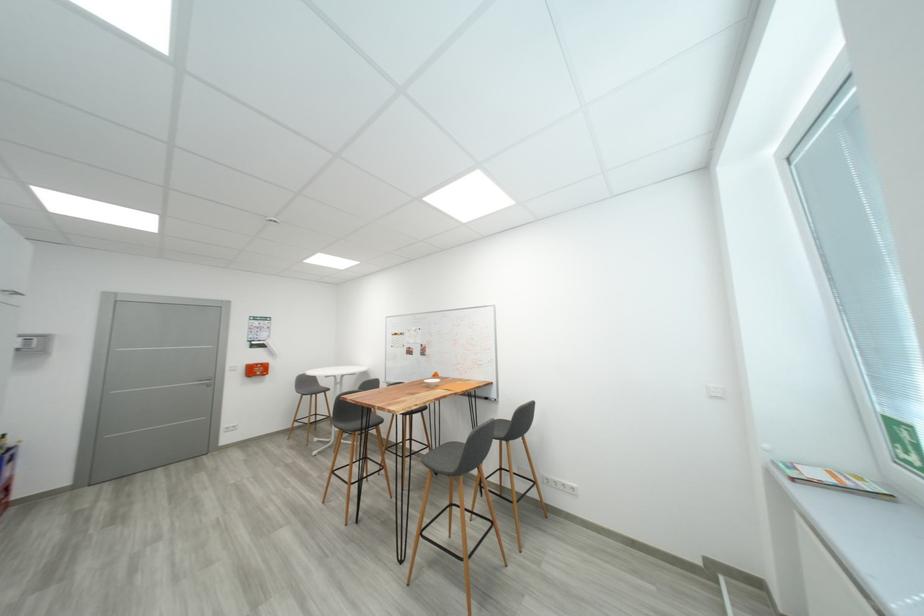
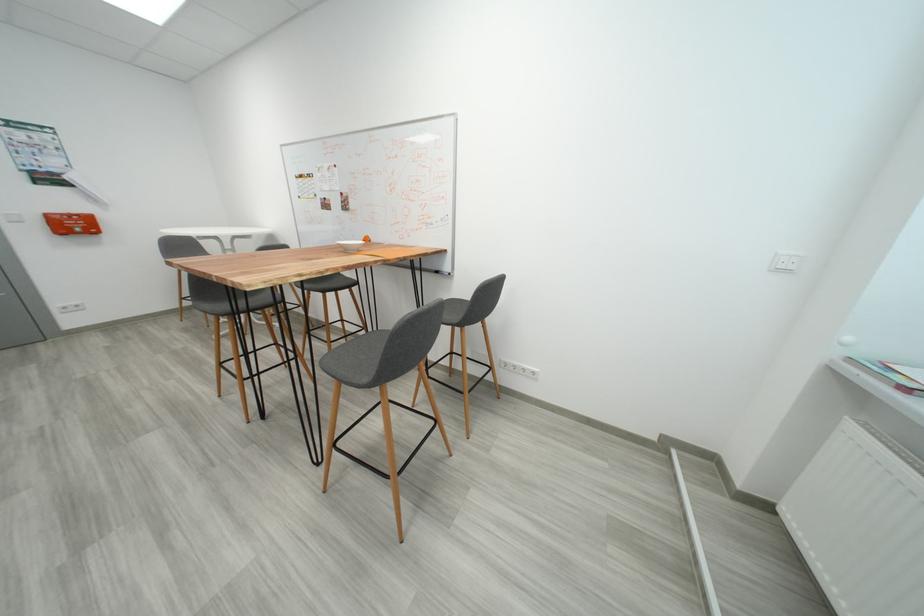
Where in the second image is the point corresponding to [511,436] from the first image?

(464, 320)